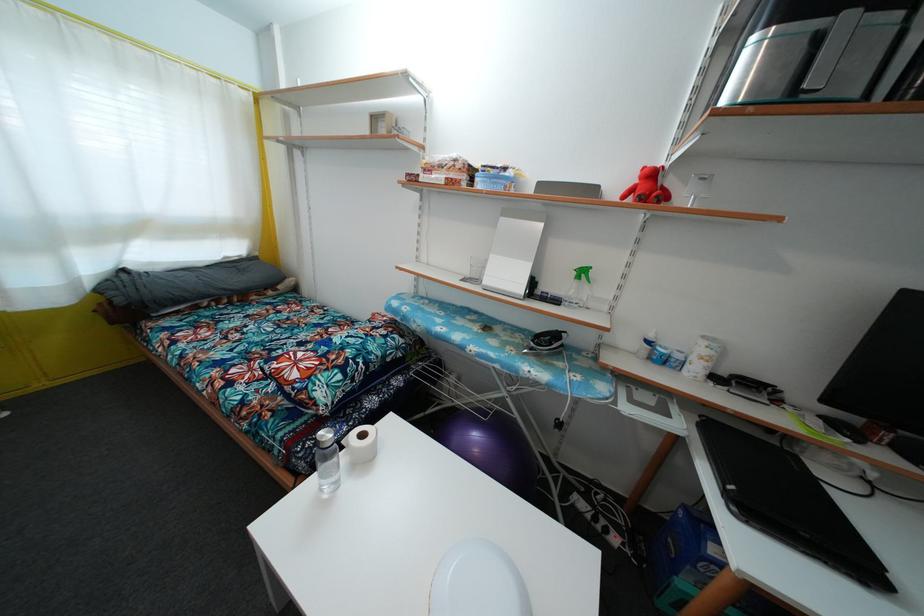
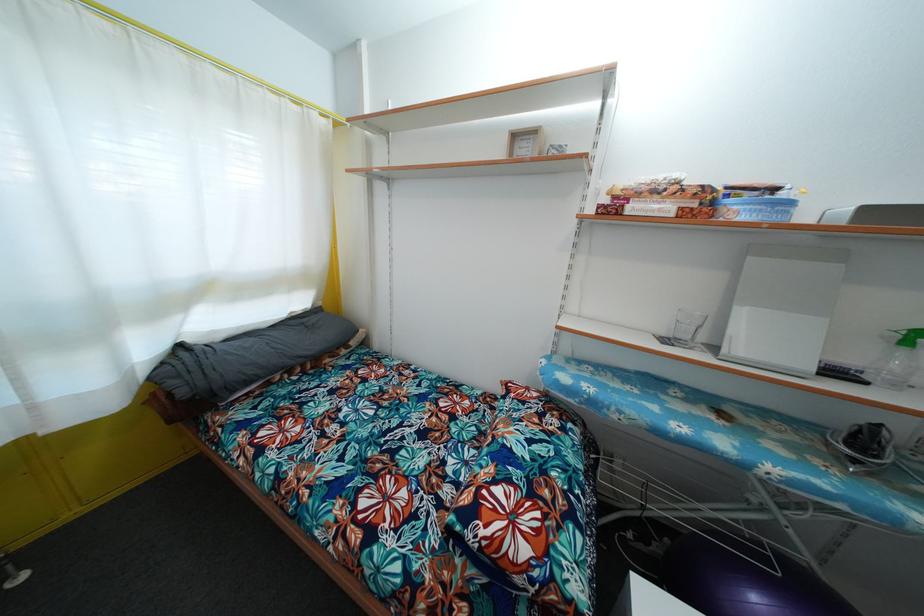
Locate, in the second image, the point that corresponds to the point at 123,307 in the first image.

(187, 399)